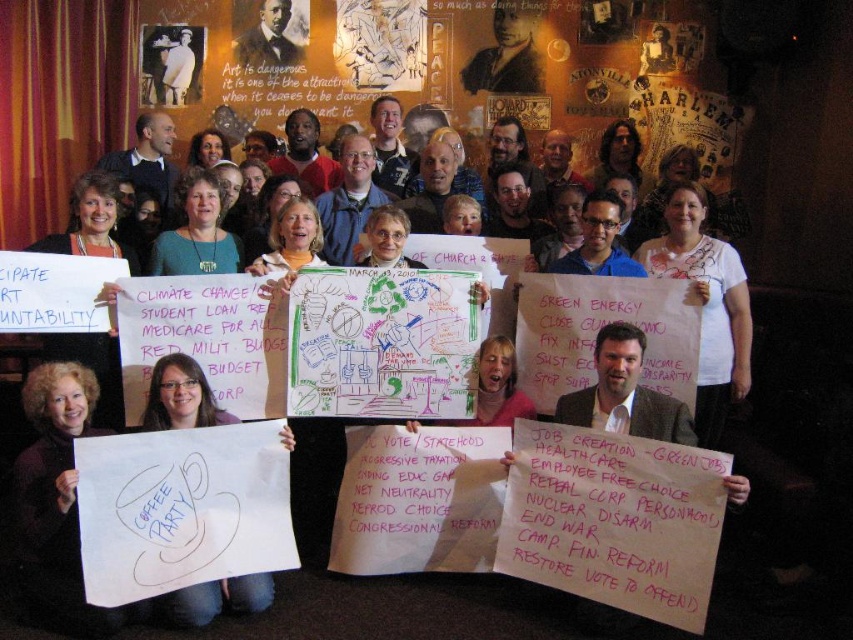
You are organizing a photo shoot and need to ensure that the white paper at lower left and the matte black suit at center are in focus simultaneously. Given that the camera you are using has a depth of field range of 7 meters, will both objects be in focus?

The distance between the white paper at lower left and the matte black suit at center is 6.96 meters, which is within the camera depth of field range of 7 meters. Therefore, both objects will be in focus.

You are organizing a photo shoot and need to ensure that the white paper at lower left and the matte black suit at center are both visible in the frame. Given their sizes, which object might require you to adjust the camera angle to ensure it doesn not get lost in the background?

The white paper at lower left is smaller than the matte black suit at center, so you might need to adjust the camera angle to ensure the smaller white paper at lower left is clearly visible in the frame.

You are standing in the room and want to reach both the point at (534, 76) and the point at (285, 19). Which point should you go to first to minimize the distance you walk?

You should go to point (534, 76) first because it is closer to you than point (285, 19).